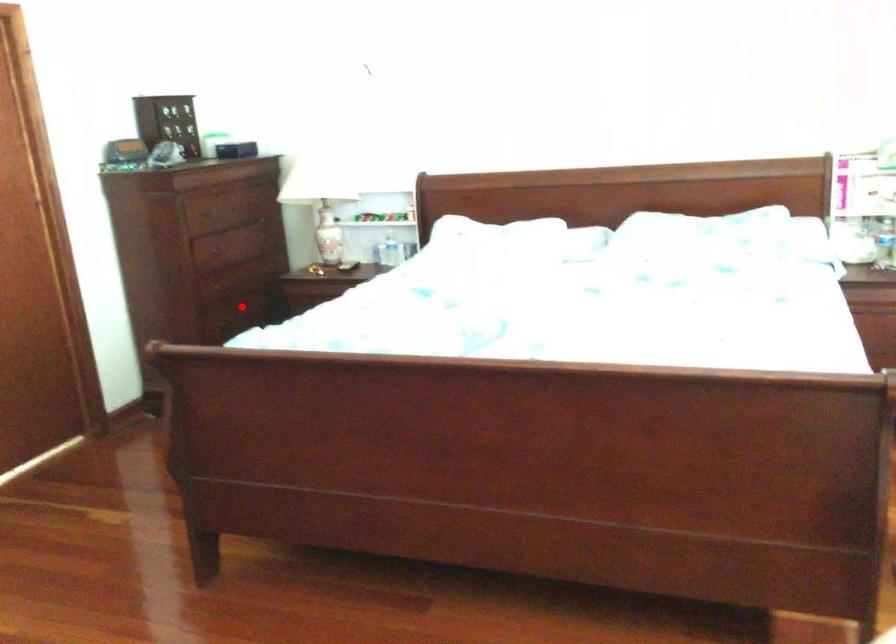
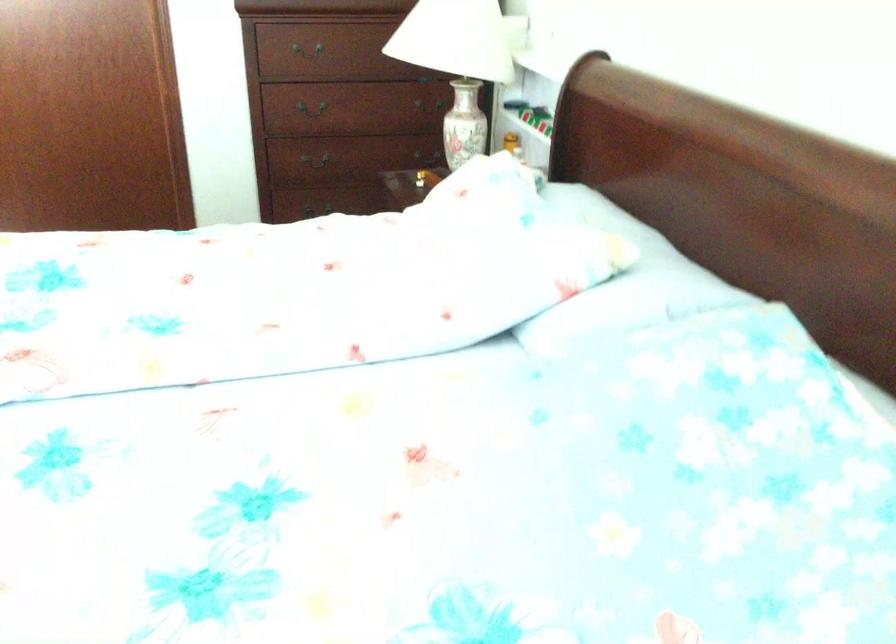
Question: A red point is marked in image1. In image2, is the corresponding 3D point closer to the camera or farther? Reply with the corresponding letter.

Choices:
 (A) The corresponding 3D point is closer.
 (B) The corresponding 3D point is farther.

Answer: (A)